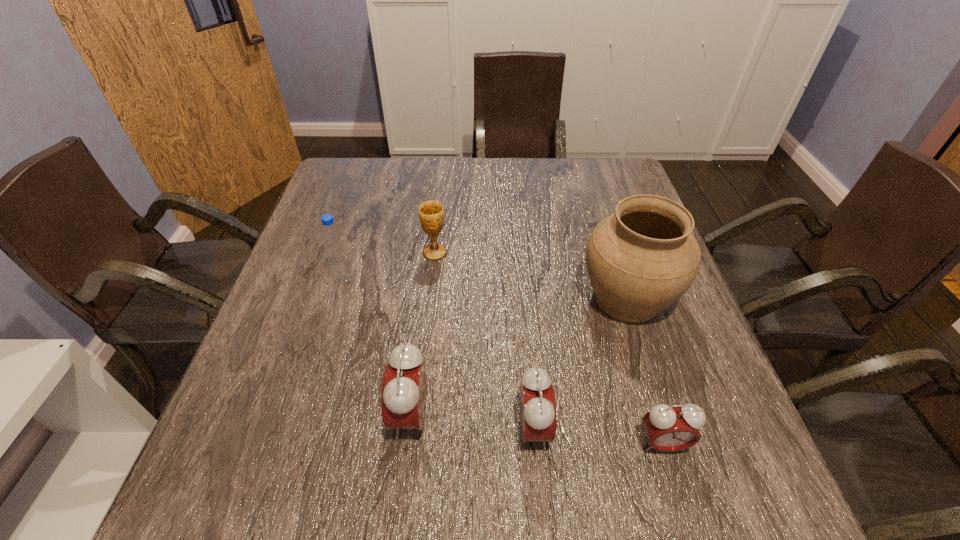
Where is `vacant space situated on the clock face of the fourth object from left to right`? vacant space situated on the clock face of the fourth object from left to right is located at coordinates (593, 429).

Where is `free space located on the left of the urn`? Image resolution: width=960 pixels, height=540 pixels. free space located on the left of the urn is located at coordinates (516, 298).

The height and width of the screenshot is (540, 960). Find the location of `blank area located on the right of the chalice`. blank area located on the right of the chalice is located at coordinates (597, 253).

Where is `free spot located 0.320m on the right of the leftmost object`? The image size is (960, 540). free spot located 0.320m on the right of the leftmost object is located at coordinates (490, 279).

This screenshot has height=540, width=960. Identify the location of object that is at the left edge. (332, 238).

Find the location of a particular element. alarm clock present at the right edge is located at coordinates (669, 428).

This screenshot has width=960, height=540. What are the coordinates of `urn present at the right edge` in the screenshot? It's located at (640, 260).

Where is `object present at the near right corner`? The height and width of the screenshot is (540, 960). object present at the near right corner is located at coordinates (669, 428).

Locate an element on the screen. vacant space at the far edge of the desktop is located at coordinates (478, 186).

Where is `free space at the near edge of the desktop`? free space at the near edge of the desktop is located at coordinates (563, 432).